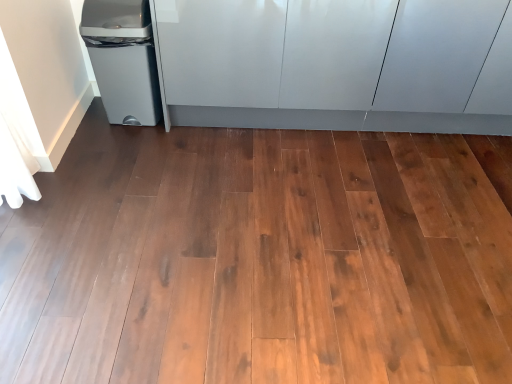
Question: Is glossy white cabinetry at upper center far from matte gray plastic trash can at left?

Choices:
 (A) yes
 (B) no

Answer: (B)

Question: Can you confirm if glossy white cabinetry at upper center is shorter than matte gray plastic trash can at left?

Choices:
 (A) no
 (B) yes

Answer: (A)

Question: Is glossy white cabinetry at upper center positioned behind matte gray plastic trash can at left?

Choices:
 (A) no
 (B) yes

Answer: (A)

Question: From a real-world perspective, is glossy white cabinetry at upper center on matte gray plastic trash can at left?

Choices:
 (A) no
 (B) yes

Answer: (B)

Question: Is matte gray plastic trash can at left at the back of glossy white cabinetry at upper center?

Choices:
 (A) no
 (B) yes

Answer: (A)

Question: Considering the positions of glossy white cabinetry at upper center and white fabric curtain at left in the image, is glossy white cabinetry at upper center taller or shorter than white fabric curtain at left?

Choices:
 (A) short
 (B) tall

Answer: (A)

Question: Considering the positions of glossy white cabinetry at upper center and white fabric curtain at left in the image, is glossy white cabinetry at upper center wider or thinner than white fabric curtain at left?

Choices:
 (A) wide
 (B) thin

Answer: (A)

Question: In terms of size, does glossy white cabinetry at upper center appear bigger or smaller than white fabric curtain at left?

Choices:
 (A) big
 (B) small

Answer: (A)

Question: Does point (402, 59) appear closer or farther from the camera than point (4, 52)?

Choices:
 (A) closer
 (B) farther

Answer: (B)

Question: From a real-world perspective, relative to matte gray plastic trash can at left, is white fabric curtain at left vertically above or below?

Choices:
 (A) below
 (B) above

Answer: (B)

Question: In the image, is white fabric curtain at left on the left side or the right side of matte gray plastic trash can at left?

Choices:
 (A) right
 (B) left

Answer: (B)

Question: Considering the positions of point (6, 72) and point (124, 21), is point (6, 72) closer or farther from the camera than point (124, 21)?

Choices:
 (A) farther
 (B) closer

Answer: (B)

Question: In the image, is white fabric curtain at left positioned in front of or behind matte gray plastic trash can at left?

Choices:
 (A) behind
 (B) front

Answer: (B)

Question: From a real-world perspective, is glossy white cabinetry at upper center positioned above or below matte gray plastic trash can at left?

Choices:
 (A) below
 (B) above

Answer: (B)

Question: From the image's perspective, relative to matte gray plastic trash can at left, is glossy white cabinetry at upper center above or below?

Choices:
 (A) below
 (B) above

Answer: (B)